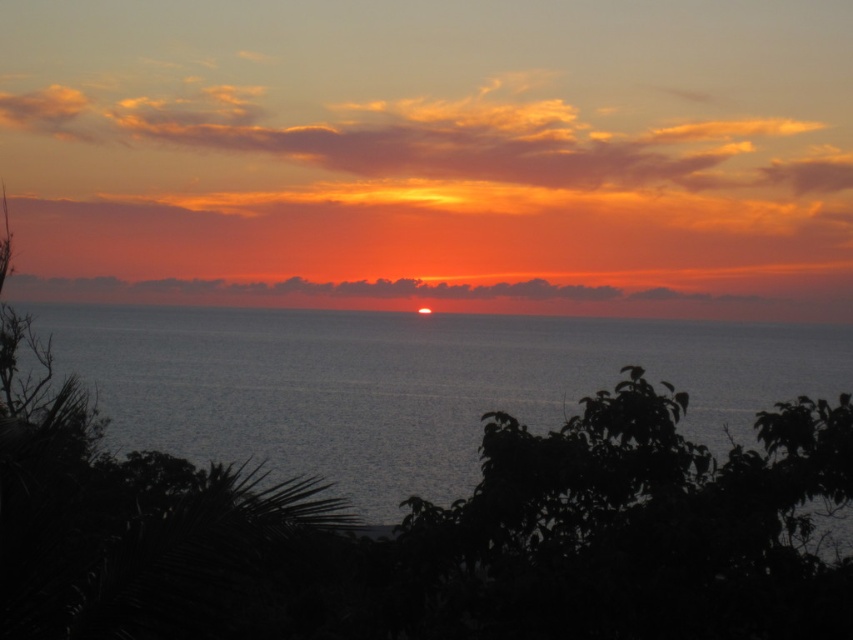
Question: Which object is farther from the camera taking this photo?

Choices:
 (A) blue water at center
 (B) smooth ocean at center

Answer: (B)

Question: Is blue water at center below smooth ocean at center?

Choices:
 (A) yes
 (B) no

Answer: (A)

Question: Does blue water at center appear on the right side of smooth ocean at center?

Choices:
 (A) no
 (B) yes

Answer: (B)

Question: Can you confirm if blue water at center is positioned to the left of smooth ocean at center?

Choices:
 (A) yes
 (B) no

Answer: (B)